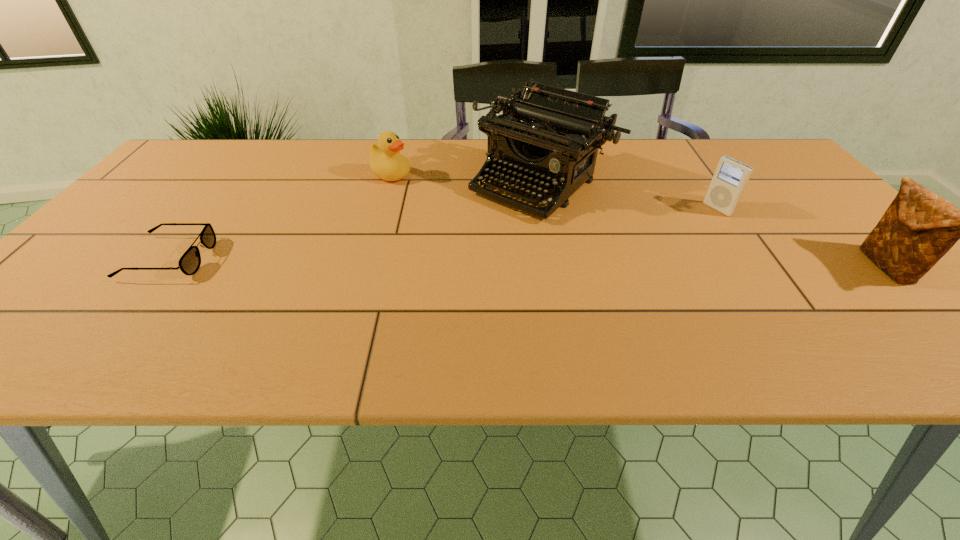
Where is `the shortest object`? The width and height of the screenshot is (960, 540). the shortest object is located at coordinates (189, 263).

I want to click on spectacles, so click(189, 263).

The image size is (960, 540). I want to click on clutch bag, so click(x=919, y=227).

Locate an element on the screen. Image resolution: width=960 pixels, height=540 pixels. the second tallest object is located at coordinates (919, 227).

Locate an element on the screen. Image resolution: width=960 pixels, height=540 pixels. iPod is located at coordinates (730, 178).

You are a GUI agent. You are given a task and a screenshot of the screen. Output one action in this format:
    pyautogui.click(x=<x>, y=<y>)
    Task: Click on the second object from left to right
    
    Given the screenshot: What is the action you would take?
    pyautogui.click(x=386, y=162)

Locate an element on the screen. The height and width of the screenshot is (540, 960). the tallest object is located at coordinates (550, 136).

Locate an element on the screen. the third object from left to right is located at coordinates (550, 136).

Locate an element on the screen. free space located 0.190m on the front-facing side of the spectacles is located at coordinates (293, 258).

I want to click on free location located on the open side of the clutch bag, so click(x=744, y=267).